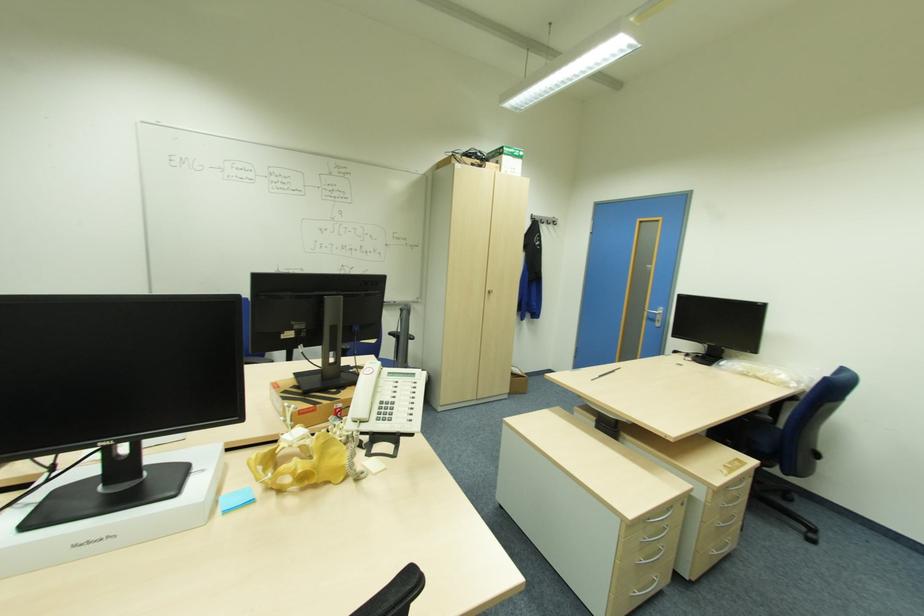
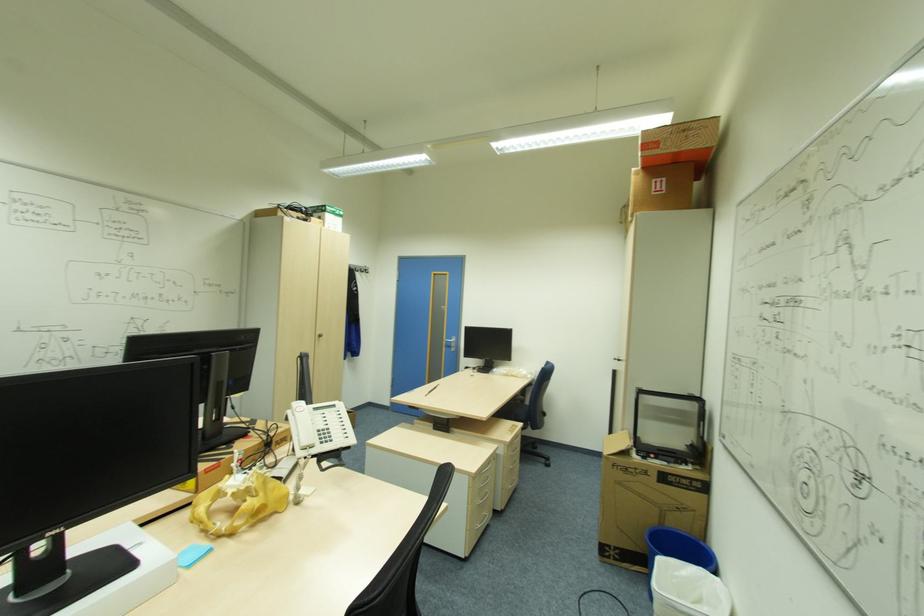
Question: The camera is either moving clockwise (left) or counter-clockwise (right) around the object. The first image is from the beginning of the video and the second image is from the end. Is the camera moving left or right when shooting the video?

Choices:
 (A) Left
 (B) Right

Answer: (A)